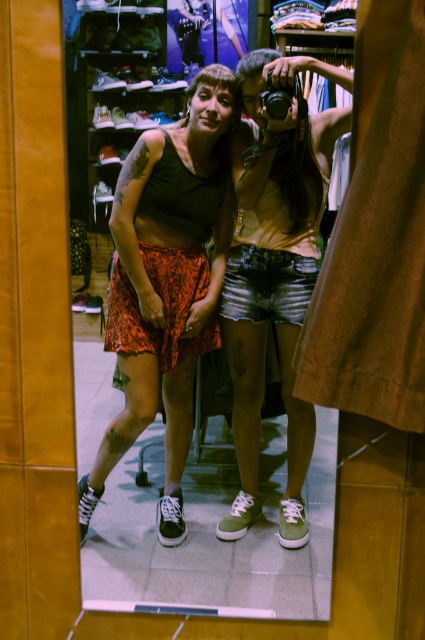
You are a photographer setting up for a photoshoot and need to ensure proper lighting. Based on the scene description, which clothing item is positioned lower on the body between the matte black tank top at center and the denim shorts at center?

The matte black tank top at center is located below the denim shorts at center, so it is positioned lower on the body.

You are standing in front of a clothing store mirror and see two points marked on the mirror at coordinates point [232,520] and point [265,96]. Which point is closer to you?

Point [232,520] is further to the camera than point [265,96], so the point closer to you is point [265,96].

You are a photographer trying to capture a detailed closeup of the matte black tank top at center and the black plastic camera at upper center. Which object should you zoom in on to ensure both fit within the frame without cropping?

The matte black tank top at center is wider than the black plastic camera at upper center, so you should zoom out enough to capture the wider matte black tank top at center first, then adjust to include the narrower black plastic camera at upper center without cropping.